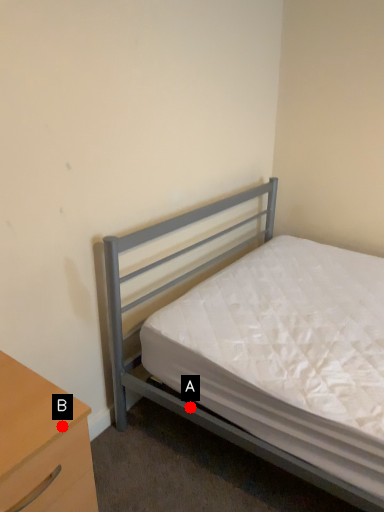
Question: Two points are circled on the image, labeled by A and B beside each circle. Which point is closer to the camera?

Choices:
 (A) A is closer
 (B) B is closer

Answer: (B)